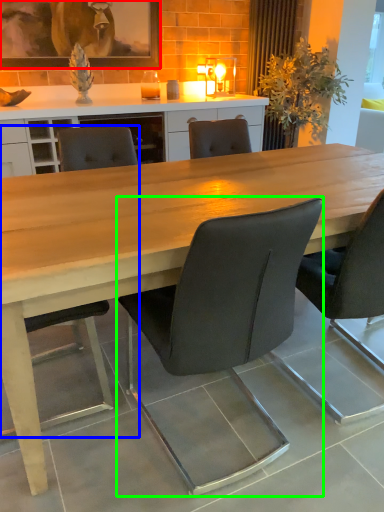
Question: Considering the real-world distances, which object is closest to picture frame (highlighted by a red box)? chair (highlighted by a blue box) or chair (highlighted by a green box).

Choices:
 (A) chair
 (B) chair

Answer: (A)